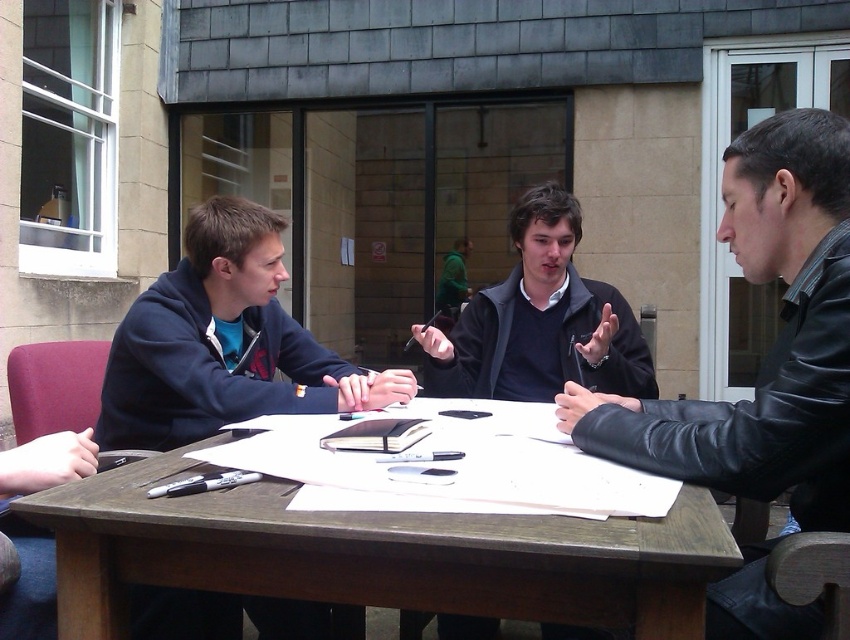
You are standing at the origin point in the image. The brown wooden table at center is located at point 0.869, 0.448. If you want to walk directly to the table, which direction should you head towards?

Since the brown wooden table at center is located at coordinates 0.869 on the x and 0.448 on the y axis, you should move towards the direction of increasing x and y values to reach it.

What object is located at the coordinates point (380,556) in the image?

The point (380,556) corresponds to the brown wooden table at center.

Looking at this image, you are standing at the edge of the table and want to pick up both the point at (392, 586) and the point at (746, 436). Which one will you reach first?

The point at (392, 586) is closer to the viewer than the point at (746, 436), so you will reach the point at (392, 586) first.